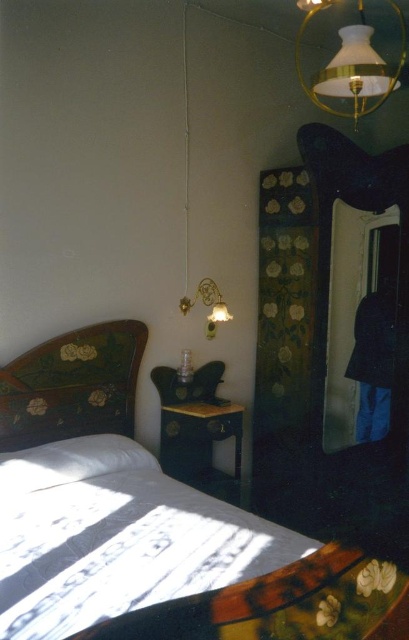
You are standing in the vintage bedroom and want to place a small decorative item at the point marked as point (280, 605). Which object is this point located on?

The point (280, 605) is located on the wooden bed with floral pattern at center.

You are standing in the vintage bedroom and want to place a new painting between the wooden bed with floral pattern at center and the matte gold lampshade at upper right. Is the space between them sufficient to fit a standard 18x24 inch painting?

The wooden bed with floral pattern at center is located below the matte gold lampshade at upper right, so there is vertical space between them. A standard 18x24 inch painting would fit vertically in that space.